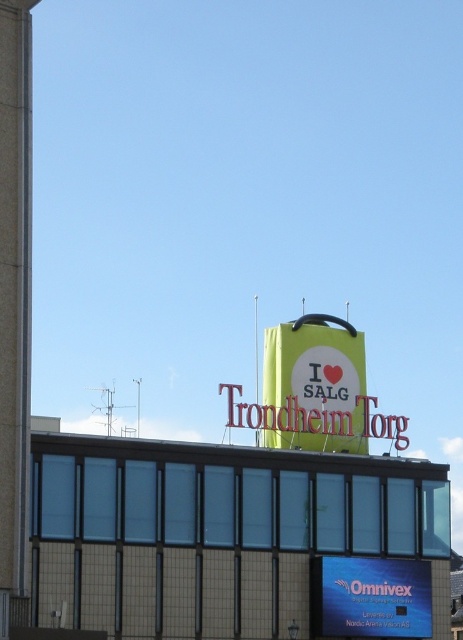
Question: Where is smooth concrete pillar at left located in relation to matte yellow sign at center in the image?

Choices:
 (A) right
 (B) left

Answer: (B)

Question: Which is nearer to the smooth concrete pillar at left?

Choices:
 (A) matte yellow sign at center
 (B) blue glossy sign at upper center

Answer: (A)

Question: Can you confirm if smooth concrete pillar at left is wider than blue glossy sign at upper center?

Choices:
 (A) yes
 (B) no

Answer: (A)

Question: Which of these objects is positioned farthest from the matte yellow sign at center?

Choices:
 (A) smooth concrete pillar at left
 (B) blue glossy sign at upper center

Answer: (A)

Question: Is smooth concrete pillar at left above blue glossy sign at upper center?

Choices:
 (A) yes
 (B) no

Answer: (A)

Question: Which object is farther from the camera taking this photo?

Choices:
 (A) smooth concrete pillar at left
 (B) blue glossy sign at upper center

Answer: (B)